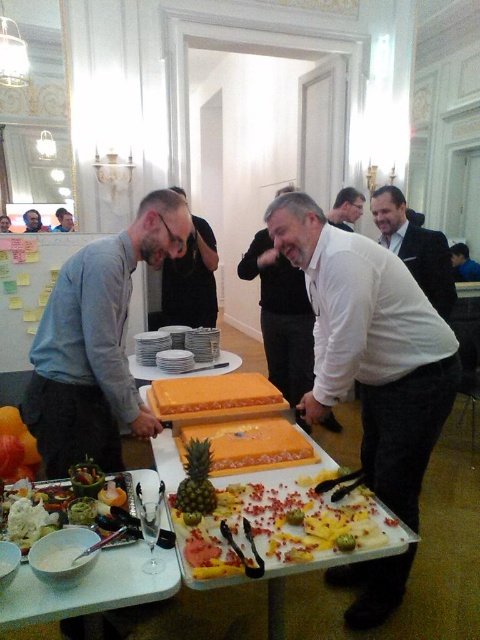
The image size is (480, 640). In order to click on dark suit at center in this screenshot , I will do `click(416, 248)`.

Which of these two, dark suit at center or smooth white shirt at center, stands shorter?

With less height is smooth white shirt at center.

What do you see at coordinates (416, 248) in the screenshot? I see `dark suit at center` at bounding box center [416, 248].

Locate an element on the screen. The width and height of the screenshot is (480, 640). dark suit at center is located at coordinates (416, 248).

Can you confirm if orange plastic tray at center is positioned above smooth white shirt at center?

No, orange plastic tray at center is not above smooth white shirt at center.

Between orange plastic tray at center and smooth white shirt at center, which one has less height?

orange plastic tray at center

You are a GUI agent. You are given a task and a screenshot of the screen. Output one action in this format:
    pyautogui.click(x=<x>, y=<y>)
    Task: Click on the orange plastic tray at center
    
    Given the screenshot: What is the action you would take?
    pyautogui.click(x=190, y=422)

Is white matte shirt at center in front of gray shirt at center?

Yes.

Does white matte shirt at center appear on the right side of gray shirt at center?

Correct, you'll find white matte shirt at center to the right of gray shirt at center.

This screenshot has height=640, width=480. What are the coordinates of `white matte shirt at center` in the screenshot? It's located at (372, 348).